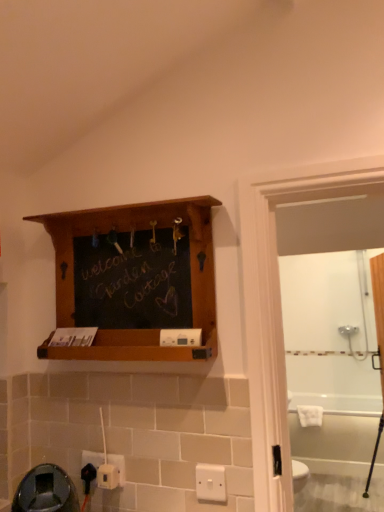
Question: Does point (84, 457) appear closer or farther from the camera than point (362, 460)?

Choices:
 (A) closer
 (B) farther

Answer: (A)

Question: Do you think white plastic electric outlet at lower left, the second electric outlet positioned from the front, is within white glossy bathtub at lower right, or outside of it?

Choices:
 (A) inside
 (B) outside

Answer: (B)

Question: Which of these objects is positioned farthest from the white plastic electric outlet at lower left, placed as the second electric outlet when sorted from back to front?

Choices:
 (A) white plastic electric outlet at lower left, the 3th electric outlet viewed from the front
 (B) white plastic electric outlet at lower center, the 1th electric outlet viewed from the front
 (C) white glossy bathtub at lower right
 (D) wooden shelf at upper center
 (E) white plastic/light switch at lower center

Answer: (C)

Question: Estimate the real-world distances between objects in this image. Which object is closer to the white plastic electric outlet at lower left, positioned as the 1th electric outlet in back-to-front order?

Choices:
 (A) white glossy bathtub at lower right
 (B) white plastic electric outlet at lower left, placed as the second electric outlet when sorted from back to front
 (C) wooden shelf at upper center
 (D) white plastic/light switch at lower center
 (E) white plastic electric outlet at lower center, the 1th electric outlet viewed from the front

Answer: (B)